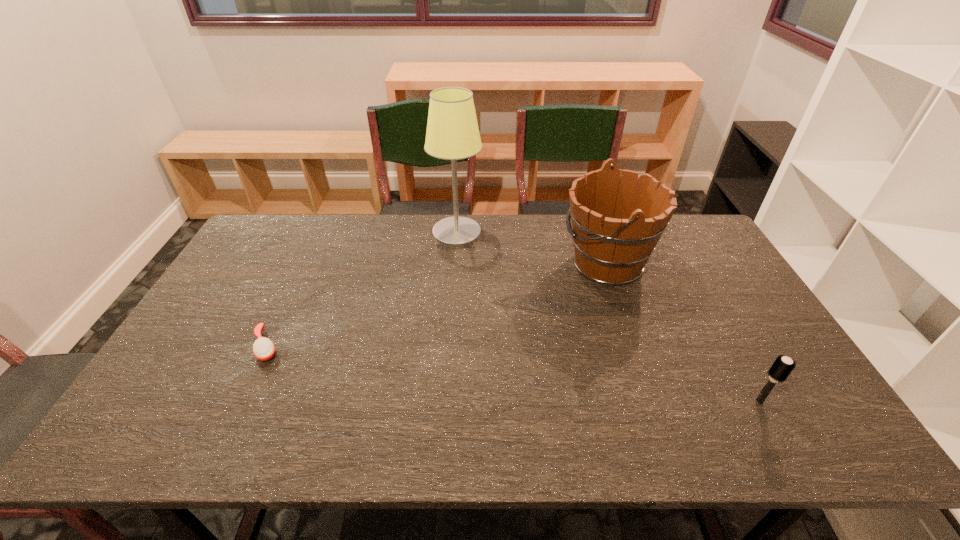
At what (x,y) coordinates should I click in order to perform the action: click on the second object from left to right. Please return your answer as a coordinate pair (x, y). This screenshot has height=540, width=960. Looking at the image, I should click on (452, 133).

I want to click on the tallest object, so click(x=452, y=133).

I want to click on wine bucket, so click(616, 226).

I want to click on the third shortest object, so click(616, 226).

Find the location of `the taller hairbrush`. the taller hairbrush is located at coordinates (782, 367).

Where is `the right hairbrush`? the right hairbrush is located at coordinates (782, 367).

Locate an element on the screen. The image size is (960, 540). the shortest object is located at coordinates (263, 348).

Locate an element on the screen. the farther hairbrush is located at coordinates tap(263, 348).

Identify the location of vacant space located 0.220m on the right of the table lamp. The image size is (960, 540). (544, 233).

You are a GUI agent. You are given a task and a screenshot of the screen. Output one action in this format:
    pyautogui.click(x=<x>, y=<y>)
    Task: Click on the vacant area situated 0.110m with the handle on the third object from left to right
    The width and height of the screenshot is (960, 540).
    Given the screenshot: What is the action you would take?
    pyautogui.click(x=526, y=263)